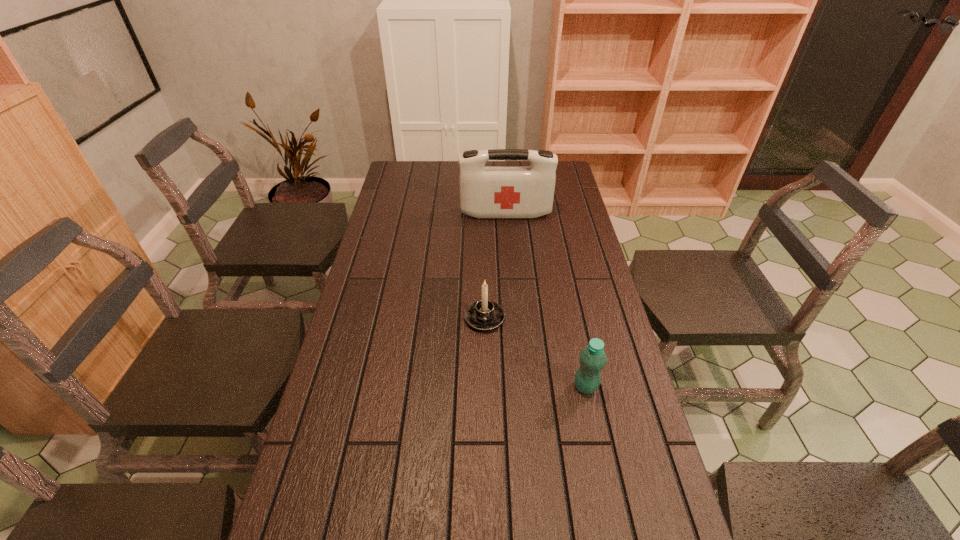
Where is `water bottle that is at the right edge`? water bottle that is at the right edge is located at coordinates (592, 358).

At what (x,y) coordinates should I click in order to perform the action: click on free space at the far edge. Please return your answer as a coordinate pair (x, y). The image size is (960, 540). Looking at the image, I should click on (433, 176).

Locate an element on the screen. The image size is (960, 540). free space at the left edge of the desktop is located at coordinates (375, 325).

In the image, there is a desktop. Where is `blank space at the right edge`? blank space at the right edge is located at coordinates (620, 398).

Identify the location of free space between the candle holder and the water bottle. (535, 352).

Identify the location of unoccupied area between the nearest object and the second farthest object. (535, 352).

I want to click on free space between the tallest object and the water bottle, so click(545, 300).

Image resolution: width=960 pixels, height=540 pixels. Find the location of `vacant area between the candle holder and the tallest object`. vacant area between the candle holder and the tallest object is located at coordinates (495, 266).

This screenshot has height=540, width=960. Identify the location of free space between the first-aid kit and the second farthest object. (495, 266).

This screenshot has height=540, width=960. Find the location of `vacant area that lies between the candle holder and the first-aid kit`. vacant area that lies between the candle holder and the first-aid kit is located at coordinates (495, 266).